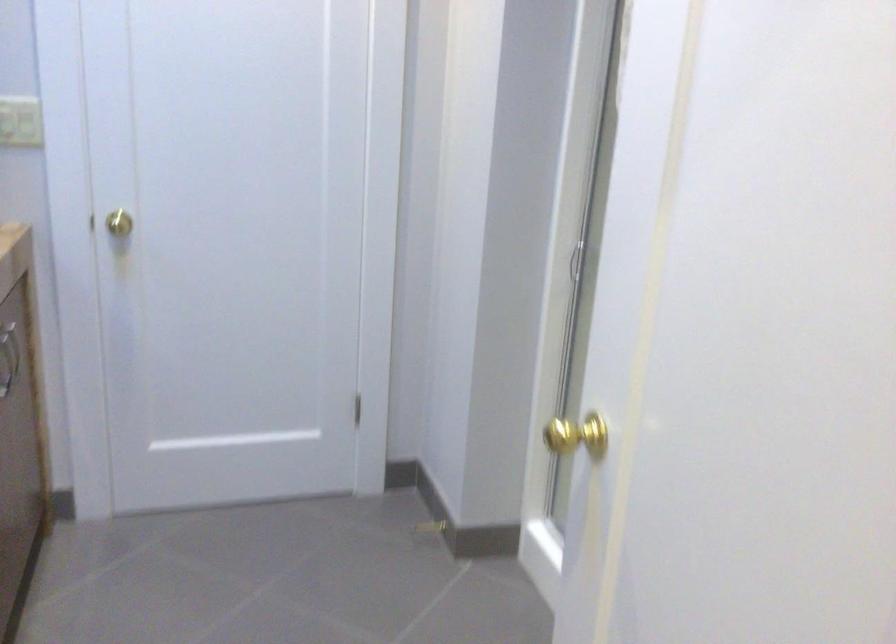
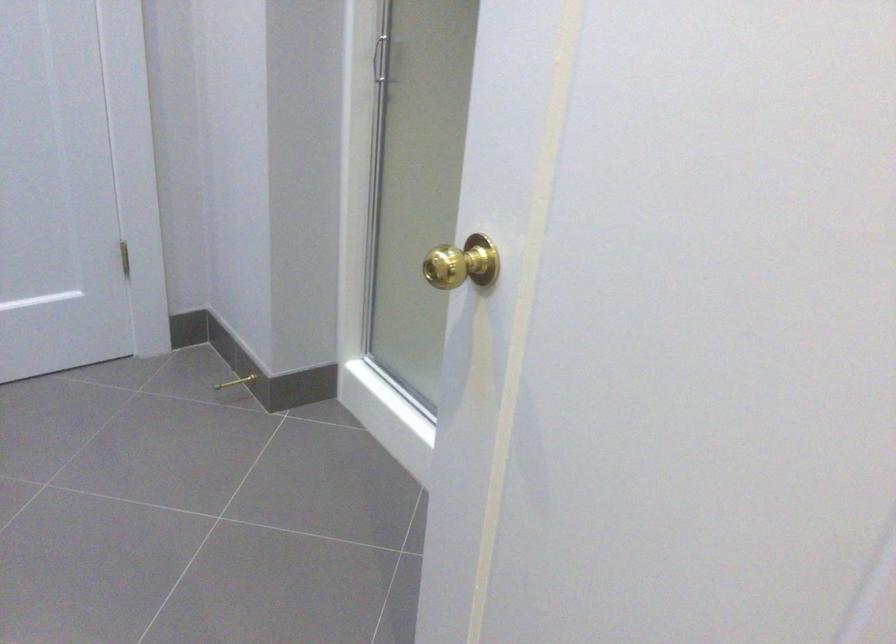
Locate, in the second image, the point that corresponds to the point at 432,527 in the first image.

(235, 382)